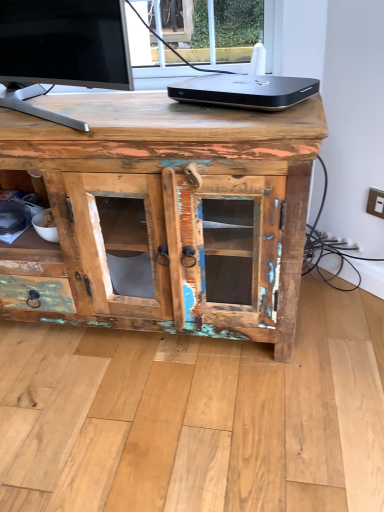
Question: Is black metallic device at upper center facing towards rustic wood cabinet at center?

Choices:
 (A) no
 (B) yes

Answer: (A)

Question: From a real-world perspective, is black metallic device at upper center beneath rustic wood cabinet at center?

Choices:
 (A) yes
 (B) no

Answer: (B)

Question: Is black metallic device at upper center not near rustic wood cabinet at center?

Choices:
 (A) no
 (B) yes

Answer: (A)

Question: Are black metallic device at upper center and rustic wood cabinet at center making contact?

Choices:
 (A) no
 (B) yes

Answer: (A)

Question: From the image's perspective, is black metallic device at upper center on top of rustic wood cabinet at center?

Choices:
 (A) yes
 (B) no

Answer: (A)

Question: Choose the correct answer: Is black metallic device at upper center inside rustic wood cabinet at center or outside it?

Choices:
 (A) outside
 (B) inside

Answer: (A)

Question: From the image's perspective, is black metallic device at upper center located above or below rustic wood cabinet at center?

Choices:
 (A) above
 (B) below

Answer: (A)

Question: Does point (269, 96) appear closer or farther from the camera than point (253, 258)?

Choices:
 (A) farther
 (B) closer

Answer: (B)

Question: Considering their positions, is black metallic device at upper center located in front of or behind rustic wood cabinet at center?

Choices:
 (A) behind
 (B) front

Answer: (A)

Question: Is rustic wood cabinet at center taller or shorter than metallic beige switch at upper right?

Choices:
 (A) short
 (B) tall

Answer: (B)

Question: Based on their positions, is rustic wood cabinet at center located to the left or right of metallic beige switch at upper right?

Choices:
 (A) right
 (B) left

Answer: (B)

Question: Considering the positions of point (223, 117) and point (375, 188), is point (223, 117) closer or farther from the camera than point (375, 188)?

Choices:
 (A) closer
 (B) farther

Answer: (A)

Question: Considering the positions of rustic wood cabinet at center and metallic beige switch at upper right in the image, is rustic wood cabinet at center bigger or smaller than metallic beige switch at upper right?

Choices:
 (A) small
 (B) big

Answer: (B)

Question: Is black metallic device at upper center bigger or smaller than metallic beige switch at upper right?

Choices:
 (A) big
 (B) small

Answer: (A)

Question: Is black metallic device at upper center wider or thinner than metallic beige switch at upper right?

Choices:
 (A) wide
 (B) thin

Answer: (A)